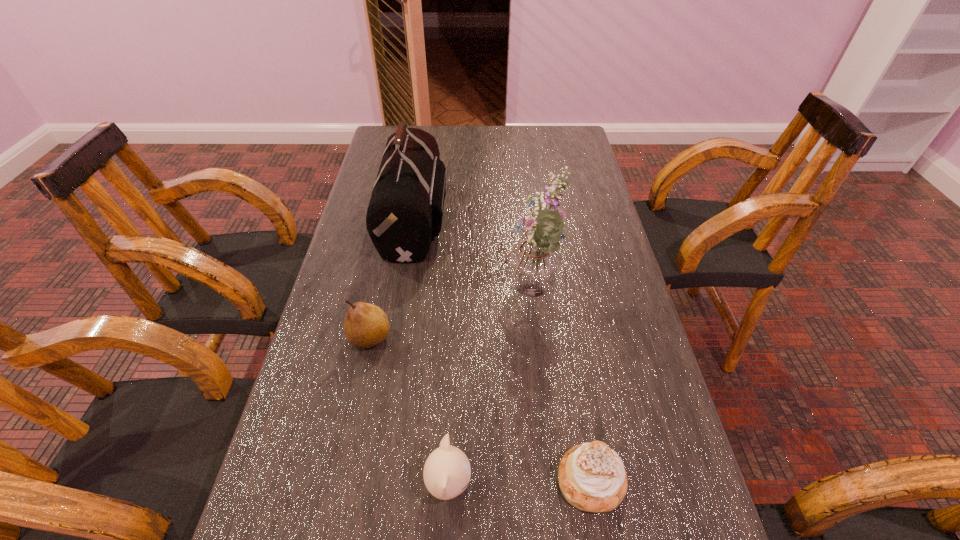
Identify the location of vacant space located 0.270m on the face of the third object from right to left. (625, 484).

Locate an element on the screen. The image size is (960, 540). free space located 0.050m on the back of the pastry is located at coordinates (581, 423).

Locate an element on the screen. duffel bag present at the left edge is located at coordinates (406, 207).

Locate an element on the screen. The image size is (960, 540). pear that is at the left edge is located at coordinates (366, 325).

This screenshot has height=540, width=960. I want to click on object present at the right edge, so click(592, 478).

This screenshot has height=540, width=960. In the image, there is a desktop. Find the location of `vacant space at the far edge`. vacant space at the far edge is located at coordinates tap(535, 153).

Image resolution: width=960 pixels, height=540 pixels. What are the coordinates of `vacant space at the left edge of the desktop` in the screenshot? It's located at (359, 465).

What are the coordinates of `vacant region at the right edge of the desktop` in the screenshot? It's located at (558, 164).

Identify the location of free space at the far right corner of the desktop. Image resolution: width=960 pixels, height=540 pixels. [564, 128].

At what (x,y) coordinates should I click in order to perform the action: click on empty space that is in between the pastry and the third tallest object. Please return your answer as a coordinate pair (x, y). This screenshot has width=960, height=540. Looking at the image, I should click on (481, 409).